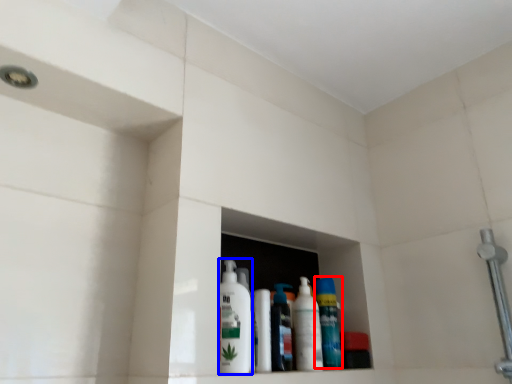
Question: Among these objects, which one is nearest to the camera, cleaning product (highlighted by a red box) or cleaning product (highlighted by a blue box)?

Choices:
 (A) cleaning product
 (B) cleaning product

Answer: (B)